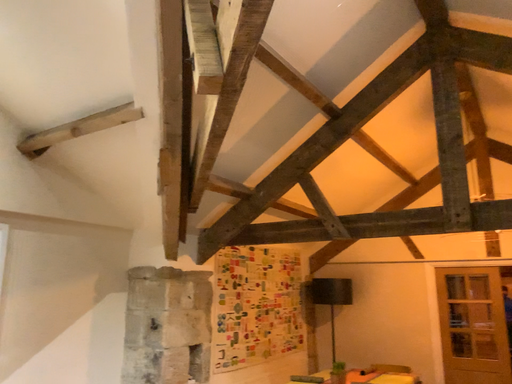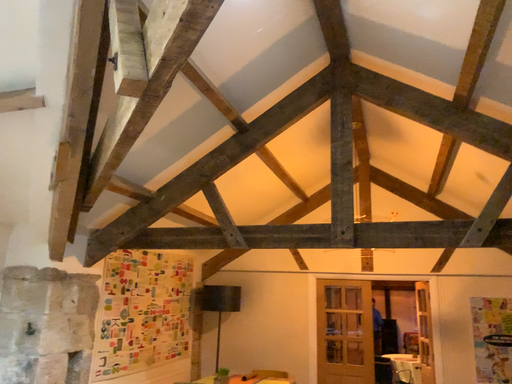
Question: How did the camera likely rotate when shooting the video?

Choices:
 (A) rotated right
 (B) rotated left

Answer: (A)